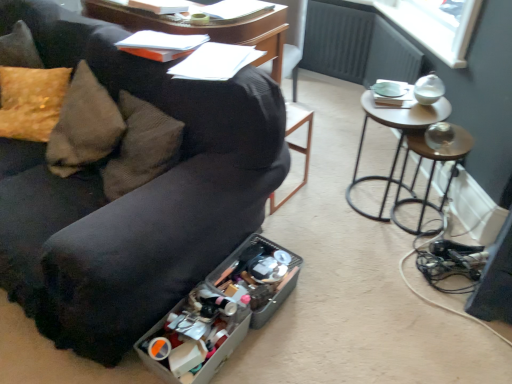
Question: Should I look upward or downward to see black leather bar stool at center?

Choices:
 (A) up
 (B) down

Answer: (A)

Question: Considering the relative sizes of black fabric couch at lower left and translucent plastic storage box at lower center, the first storage box positioned from the front, in the image provided, is black fabric couch at lower left smaller than translucent plastic storage box at lower center, the first storage box positioned from the front,?

Choices:
 (A) no
 (B) yes

Answer: (A)

Question: Can you confirm if black fabric couch at lower left is bigger than translucent plastic storage box at lower center, arranged as the second storage box when viewed from the back?

Choices:
 (A) yes
 (B) no

Answer: (A)

Question: Does black fabric couch at lower left have a lesser width compared to translucent plastic storage box at lower center, arranged as the second storage box when viewed from the back?

Choices:
 (A) yes
 (B) no

Answer: (B)

Question: Would you say black fabric couch at lower left is outside translucent plastic storage box at lower center, arranged as the second storage box when viewed from the back?

Choices:
 (A) no
 (B) yes

Answer: (B)

Question: Can you confirm if black fabric couch at lower left is shorter than translucent plastic storage box at lower center, arranged as the second storage box when viewed from the back?

Choices:
 (A) yes
 (B) no

Answer: (B)

Question: From a real-world perspective, is black fabric couch at lower left under translucent plastic storage box at lower center, the first storage box positioned from the front?

Choices:
 (A) no
 (B) yes

Answer: (A)

Question: Is translucent plastic storage box at lower center, the first storage box positioned from the front, not inside black fabric couch at lower left?

Choices:
 (A) no
 (B) yes

Answer: (A)

Question: From a real-world perspective, is translucent plastic storage box at lower center, arranged as the second storage box when viewed from the back, on black fabric couch at lower left?

Choices:
 (A) no
 (B) yes

Answer: (A)

Question: Is translucent plastic storage box at lower center, arranged as the second storage box when viewed from the back, in contact with black fabric couch at lower left?

Choices:
 (A) no
 (B) yes

Answer: (A)

Question: From the image's perspective, is translucent plastic storage box at lower center, arranged as the second storage box when viewed from the back, under black fabric couch at lower left?

Choices:
 (A) no
 (B) yes

Answer: (B)

Question: From a real-world perspective, is translucent plastic storage box at lower center, the first storage box positioned from the front, located beneath black fabric couch at lower left?

Choices:
 (A) no
 (B) yes

Answer: (B)

Question: Can you confirm if translucent plastic storage box at lower center, arranged as the second storage box when viewed from the back, is positioned to the right of black fabric couch at lower left?

Choices:
 (A) yes
 (B) no

Answer: (A)

Question: Is translucent plastic storage box at lower center, the first storage box positioned from the front, facing towards black leather bar stool at center?

Choices:
 (A) no
 (B) yes

Answer: (A)